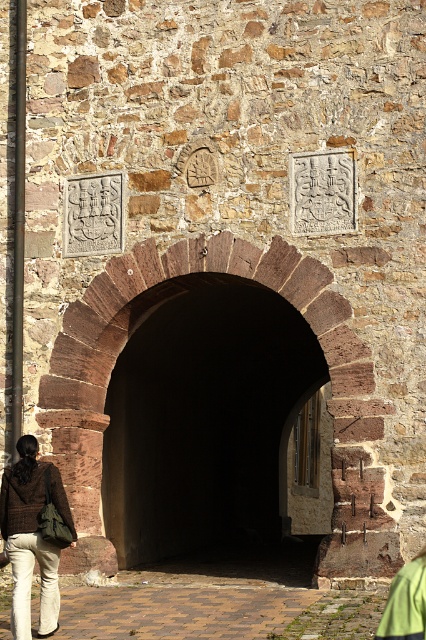
Question: Estimate the real-world distances between objects in this image. Which object is closer to the dark stone tunnel at center?

Choices:
 (A) khaki cotton pants at lower left
 (B) brick pavement at lower center

Answer: (B)

Question: Does dark stone tunnel at center appear under khaki cotton pants at lower left?

Choices:
 (A) yes
 (B) no

Answer: (B)

Question: Which object is closer to the camera taking this photo?

Choices:
 (A) dark stone tunnel at center
 (B) brick pavement at lower center
 (C) khaki cotton pants at lower left

Answer: (B)

Question: Can you confirm if dark stone tunnel at center is positioned below khaki cotton pants at lower left?

Choices:
 (A) yes
 (B) no

Answer: (B)

Question: Can you confirm if brick pavement at lower center is positioned above khaki cotton pants at lower left?

Choices:
 (A) no
 (B) yes

Answer: (A)

Question: Which is nearer to the brick pavement at lower center?

Choices:
 (A) dark stone tunnel at center
 (B) khaki cotton pants at lower left

Answer: (B)